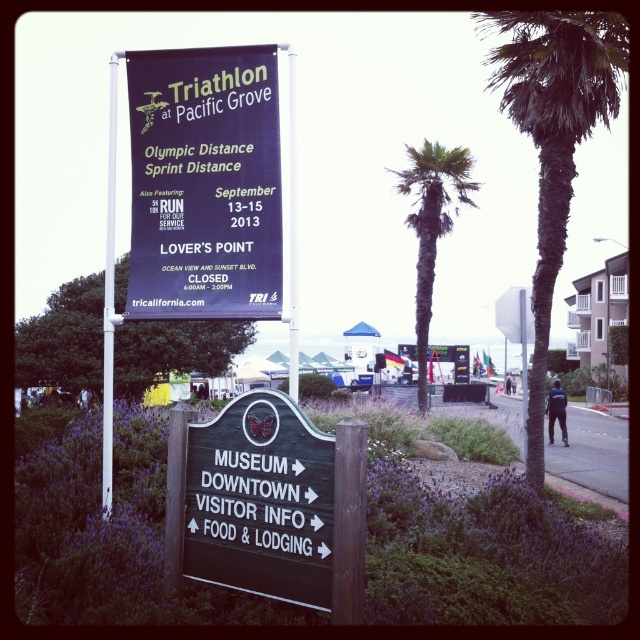
You are a participant at the Triathlon event and you see the dark purple banner at center and the white plastic pole at upper left. Which object is positioned more to the left?

The white plastic pole at upper left is positioned more to the left than the dark purple banner at center.

You are a participant in the Triathlon event and need to locate the starting line. You see the green leafy palm tree at center and the white plastic pole at upper center. Which object is taller and can help you determine your direction?

The green leafy palm tree at center is much taller than the white plastic pole at upper center, so it can be used as a reference point to determine direction.